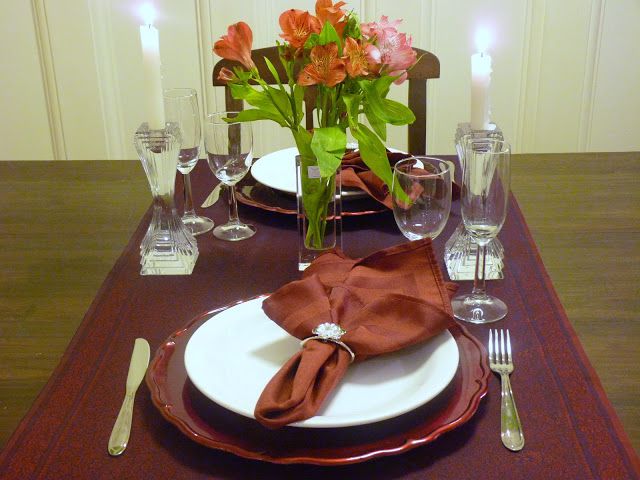
This screenshot has width=640, height=480. In order to click on plates in this screenshot , I will do `click(276, 175)`, `click(276, 203)`, `click(210, 354)`, `click(173, 387)`.